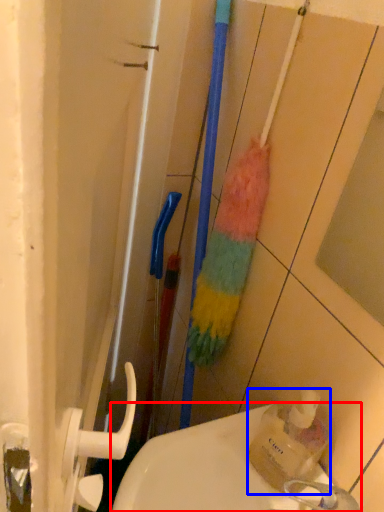
Question: Which of the following is the farthest to the observer, sink (highlighted by a red box) or bottle (highlighted by a blue box)?

Choices:
 (A) sink
 (B) bottle

Answer: (B)